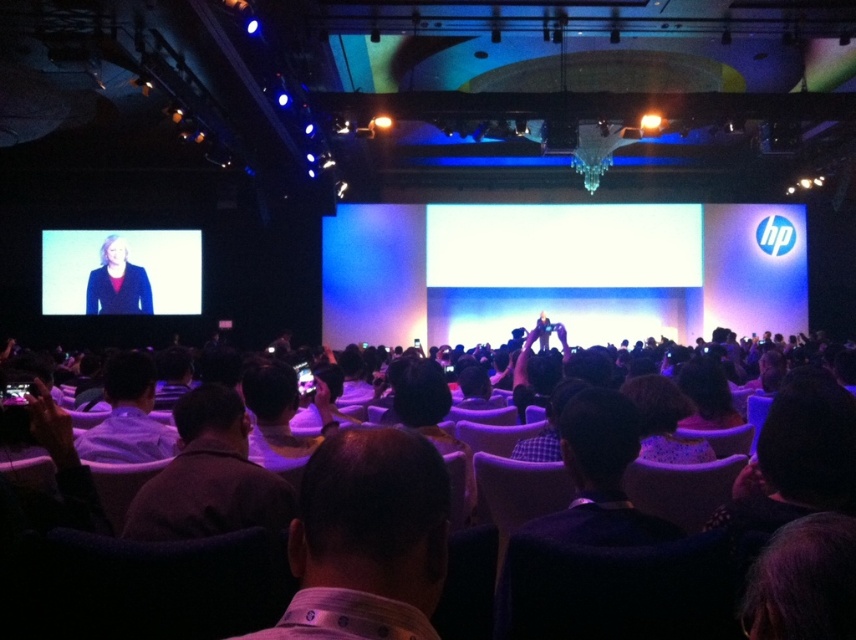
Question: Does dark brown shirt at center lie behind matte black jacket at upper left?

Choices:
 (A) no
 (B) yes

Answer: (A)

Question: Which point is closer to the camera?

Choices:
 (A) (126, 429)
 (B) (116, 253)
 (C) (111, 300)
 (D) (428, 596)

Answer: (D)

Question: Is matte black jacket at upper left wider than matte black jacket at left?

Choices:
 (A) no
 (B) yes

Answer: (B)

Question: Does brown fabric jacket at center lie behind matte black jacket at left?

Choices:
 (A) no
 (B) yes

Answer: (A)

Question: Which point is closer to the camera taking this photo?

Choices:
 (A) (150, 484)
 (B) (173, 436)
 (C) (114, 301)

Answer: (A)

Question: Which point is farther to the camera?

Choices:
 (A) (114, 266)
 (B) (146, 269)
 (C) (187, 484)

Answer: (B)